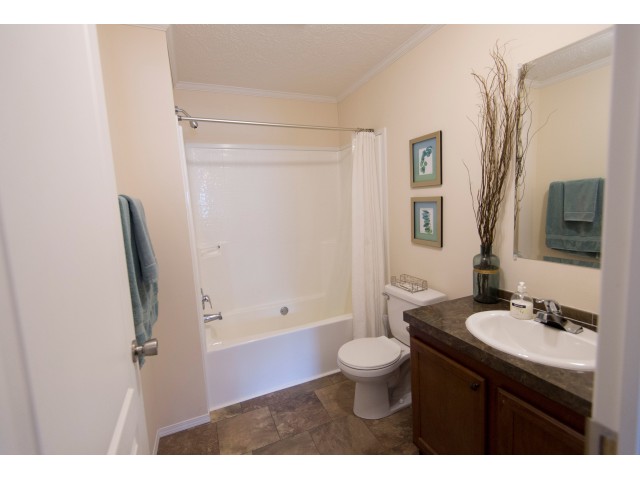
Find the location of a particular element. sink is located at coordinates (566, 352).